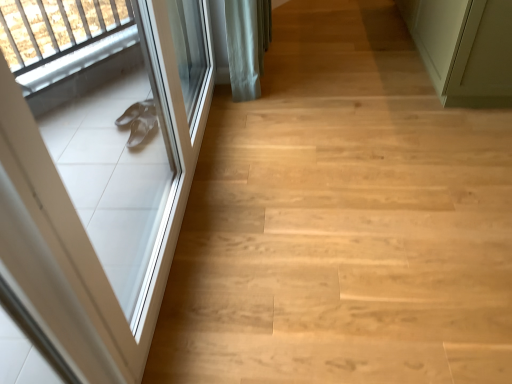
Question: From the image's perspective, is white glossy door at left, marked as the 1th door in a left-to-right arrangement, located above or below light wood floor at left?

Choices:
 (A) above
 (B) below

Answer: (B)

Question: Is white glossy door at left, which ranks as the 2th door in right-to-left order, taller or shorter than light wood floor at left?

Choices:
 (A) tall
 (B) short

Answer: (A)

Question: Estimate the real-world distances between objects in this image. Which object is closer to the green matte door at upper right, which is the second door from left to right?

Choices:
 (A) light wood floor at left
 (B) white glossy door at left, which ranks as the 2th door in right-to-left order

Answer: (A)

Question: Estimate the real-world distances between objects in this image. Which object is farther from the green matte door at upper right, which is the second door from left to right?

Choices:
 (A) light wood floor at left
 (B) white glossy door at left, which ranks as the 2th door in right-to-left order

Answer: (B)